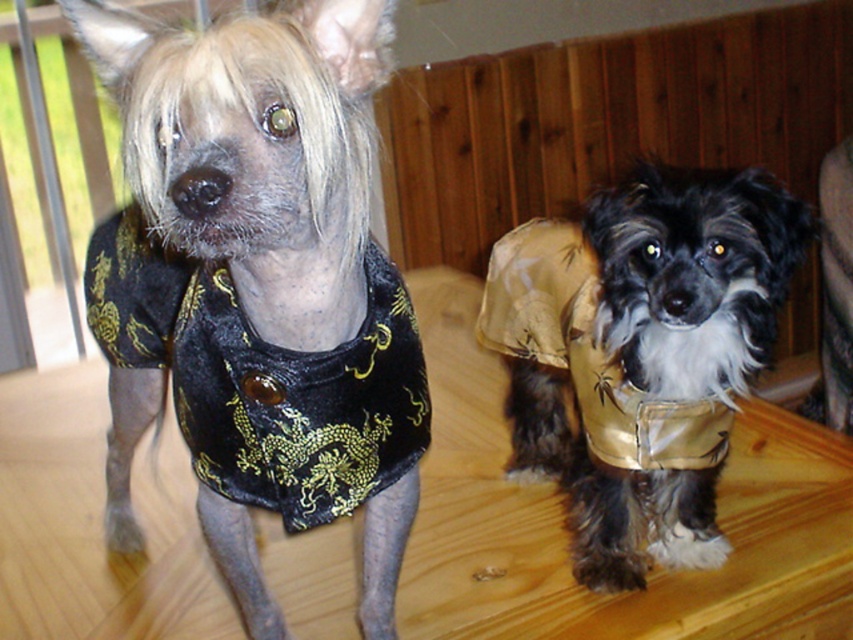
You are an interior designer working on a project and need to place a decorative item exactly at the center of the room. The gold satin vest at center is currently placed at coordinates that are slightly off the true center. What adjustment should you make to its position to align it with the room center?

The gold satin vest at center is currently located at coordinates (641, 353). To align it with the true center of the room, you would need to move it slightly to the left and upward since the true center is at (426, 320) in a normalized coordinate system.